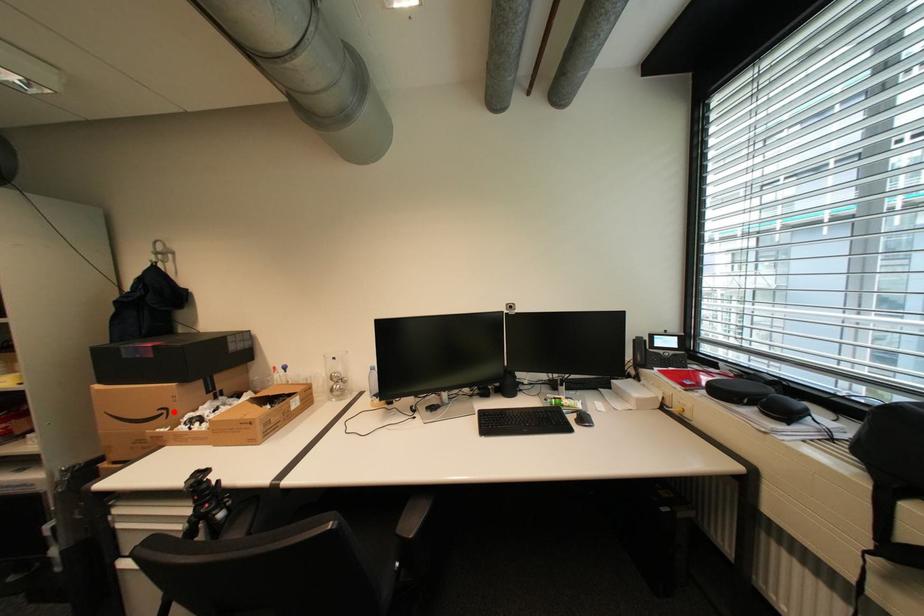
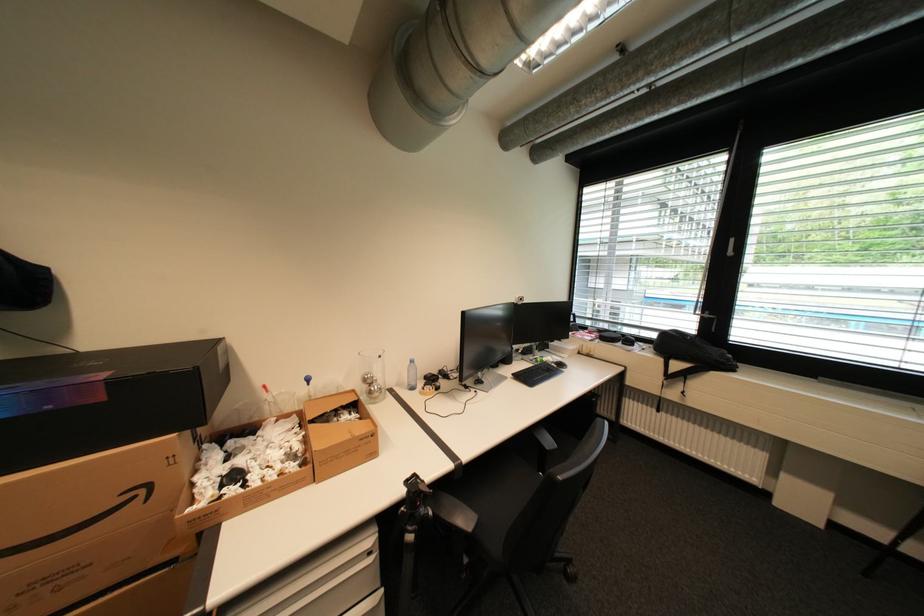
Question: I am providing you with two images of the same scene from different viewpoints. A red point is marked on the first image. Is the red point's position out of view in image 2?

Choices:
 (A) Yes
 (B) No

Answer: (B)